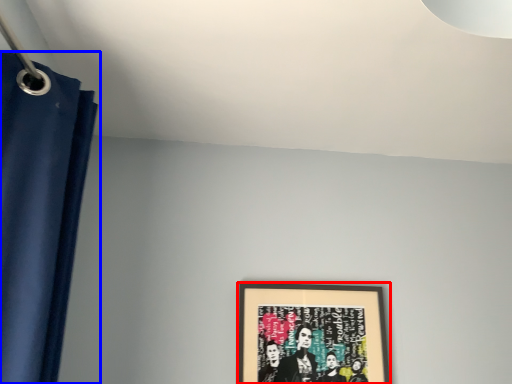
Question: Which object appears closest to the camera in this image, picture frame (highlighted by a red box) or curtain (highlighted by a blue box)?

Choices:
 (A) picture frame
 (B) curtain

Answer: (B)